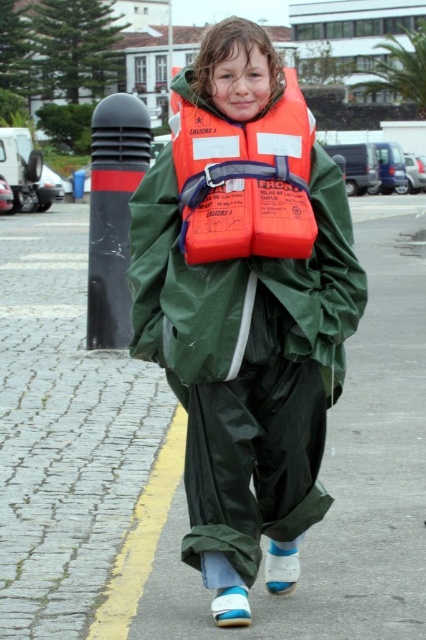
Question: From the image, what is the correct spatial relationship of brick paved road at center in relation to orange matte life jacket at center?

Choices:
 (A) above
 (B) below

Answer: (B)

Question: Estimate the real-world distances between objects in this image. Which object is farther from the orange matte life jacket at center?

Choices:
 (A) orange life vest at center
 (B) brick paved road at center

Answer: (B)

Question: Is orange life vest at center positioned before orange matte life jacket at center?

Choices:
 (A) yes
 (B) no

Answer: (A)

Question: Does brick paved road at center lie behind orange life vest at center?

Choices:
 (A) yes
 (B) no

Answer: (A)

Question: Which object is closer to the camera taking this photo?

Choices:
 (A) brick paved road at center
 (B) orange life vest at center

Answer: (B)

Question: Which object appears closest to the camera in this image?

Choices:
 (A) orange matte life jacket at center
 (B) brick paved road at center
 (C) orange life vest at center

Answer: (C)